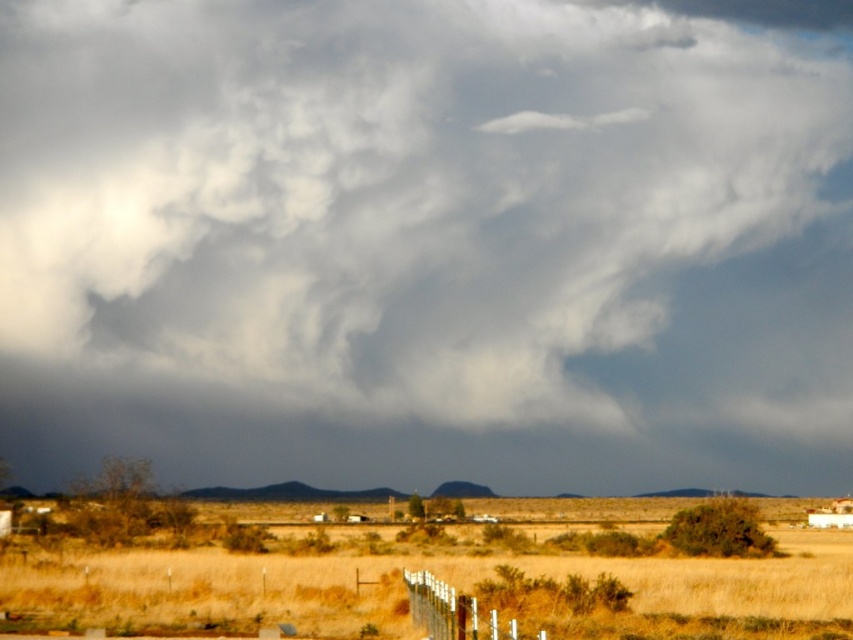
Does dry grass at lower center have a greater width compared to white wooden fence at lower center?

Yes, dry grass at lower center is wider than white wooden fence at lower center.

Describe the element at coordinates (445, 580) in the screenshot. I see `dry grass at lower center` at that location.

The width and height of the screenshot is (853, 640). I want to click on dry grass at lower center, so click(x=445, y=580).